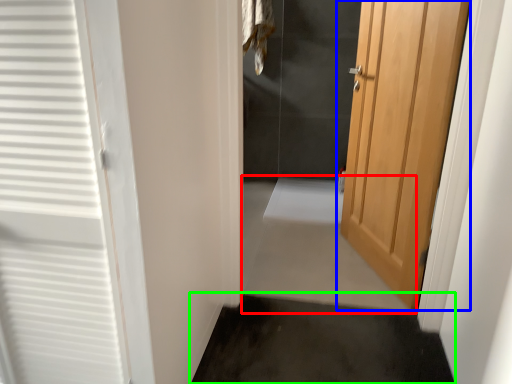
Question: Which object is the closest to the path (highlighted by a red box)? Choose among these: door (highlighted by a blue box) or path (highlighted by a green box).

Choices:
 (A) door
 (B) path

Answer: (B)